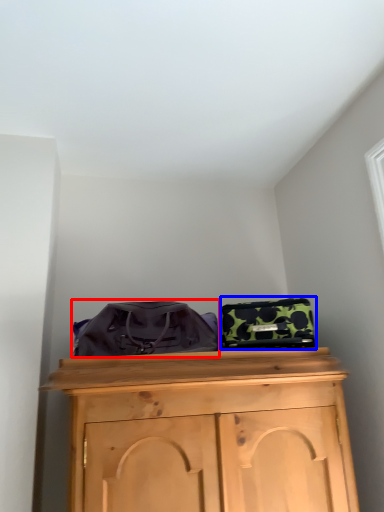
Question: Which object is further to the camera taking this photo, messenger bag (highlighted by a red box) or luggage (highlighted by a blue box)?

Choices:
 (A) messenger bag
 (B) luggage

Answer: (B)